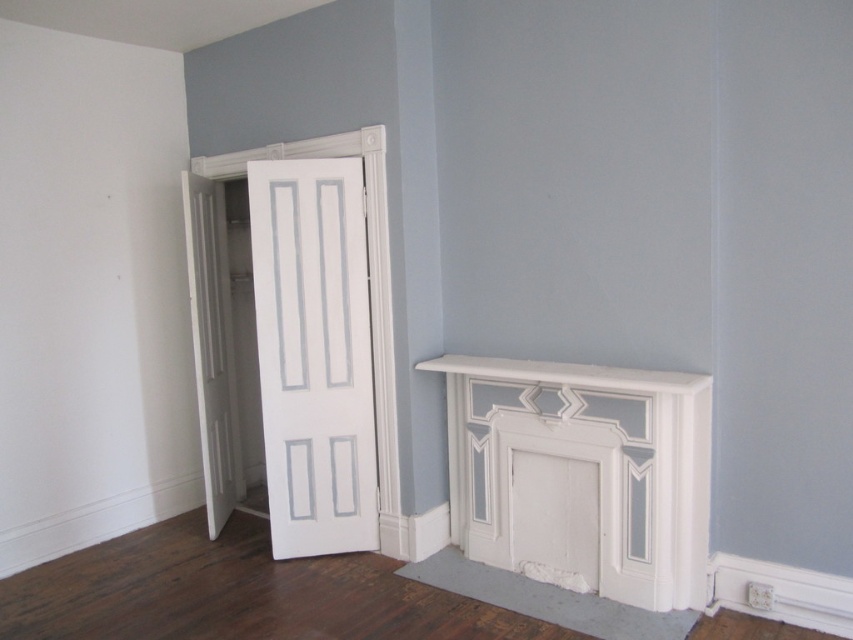
You are standing in the room and want to place a small decorative item on the white painted wood fireplace at lower right. Given that the point marked at coordinates (x=582, y=474) is part of this fireplace, can you confirm if this point is suitable for placing the item?

The point marked at coordinates (x=582, y=474) is part of the white painted wood fireplace at lower right, so it is suitable for placing the decorative item there.

You are standing in the room and want to hang a picture frame on the wall above the white painted wood fireplace at lower right and the white painted wood mantle at lower right. Which object should you choose to hang the frame above to ensure it is placed higher?

You should hang the picture frame above the white painted wood fireplace at lower right because it is much taller than the white painted wood mantle at lower right, so the frame will be placed higher.

You are standing in the room and want to place a small sculpture exactly halfway between the two points labeled point (x=456, y=525) and point (x=550, y=369). Considering their positions, will the sculpture be closer to the wall or the center of the room?

The sculpture placed halfway between point (x=456, y=525) and point (x=550, y=369) will be closer to the center of the room because point (x=456, y=525) is closer to the viewer than point (x=550, y=369), balancing their positions.